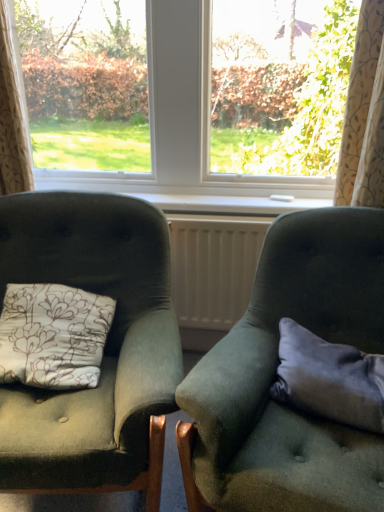
Question: Based on their positions, is floral fabric curtain at left, positioned as the second curtain in right-to-left order, located to the left or right of velvet green armchair at left, which is the 2th chair in right-to-left order?

Choices:
 (A) left
 (B) right

Answer: (A)

Question: Looking at their shapes, would you say floral fabric curtain at left, positioned as the second curtain in right-to-left order, is wider or thinner than velvet green armchair at left, which is the 2th chair in right-to-left order?

Choices:
 (A) wide
 (B) thin

Answer: (B)

Question: Considering the real-world distances, which object is farthest from the transparent glass window at center?

Choices:
 (A) white plastic radiator at center
 (B) beige floral fabric curtain at upper right, acting as the 1th curtain starting from the right
 (C) gray fabric pillow at right
 (D) floral fabric curtain at left, positioned as the second curtain in right-to-left order
 (E) white plastic radiator at center

Answer: (C)

Question: Estimate the real-world distances between objects in this image. Which object is closer to the gray fabric pillow at right?

Choices:
 (A) white plastic radiator at center
 (B) velvet green armchair at left, which is the 2th chair in right-to-left order
 (C) transparent glass window at center
 (D) white plastic radiator at center
 (E) velvet green armchair at right, acting as the 2th chair starting from the left

Answer: (E)